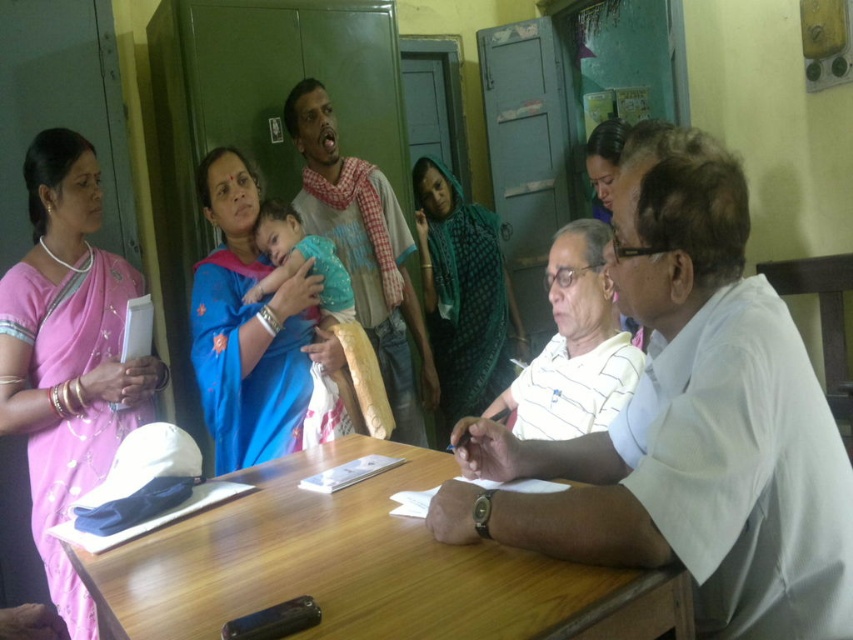
Is green textured saree at center bigger than matte green saree at upper center?

Correct, green textured saree at center is larger in size than matte green saree at upper center.

Consider the image. Who is more distant from viewer, (x=460, y=209) or (x=611, y=136)?

Point (x=460, y=209)

Is point (492, 349) closer to viewer compared to point (606, 150)?

That is False.

Find the location of a particular element. The width and height of the screenshot is (853, 640). green textured saree at center is located at coordinates (463, 294).

Is wooden table at center above green textured saree at center?

No.

Between wooden table at center and green textured saree at center, which one is positioned higher?

green textured saree at center is higher up.

The image size is (853, 640). Identify the location of wooden table at center. (363, 566).

Can you confirm if gray cotton shirt at center is taller than green textured saree at center?

Indeed, gray cotton shirt at center has a greater height compared to green textured saree at center.

Who is positioned more to the left, gray cotton shirt at center or green textured saree at center?

gray cotton shirt at center is more to the left.

Describe the element at coordinates (364, 252) in the screenshot. The width and height of the screenshot is (853, 640). I see `gray cotton shirt at center` at that location.

The image size is (853, 640). Identify the location of gray cotton shirt at center. (364, 252).